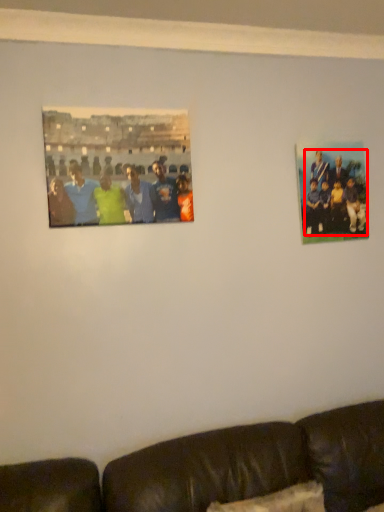
Question: From the image, what is the correct spatial relationship of person (annotated by the red box) in relation to picture frame?

Choices:
 (A) left
 (B) right

Answer: (B)